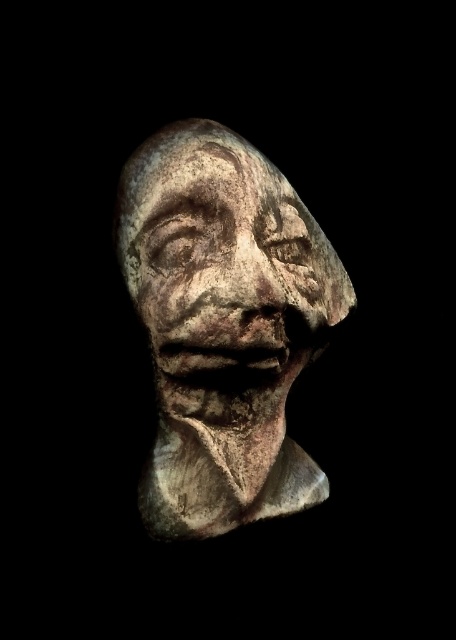
Question: Does rustic stone bust at center come in front of rusty stone face at center?

Choices:
 (A) no
 (B) yes

Answer: (A)

Question: Can you confirm if rustic stone bust at center is positioned above rusty stone face at center?

Choices:
 (A) no
 (B) yes

Answer: (A)

Question: Does rustic stone bust at center appear on the right side of rusty stone face at center?

Choices:
 (A) no
 (B) yes

Answer: (B)

Question: Among these points, which one is nearest to the camera?

Choices:
 (A) (267, 282)
 (B) (241, 385)

Answer: (A)